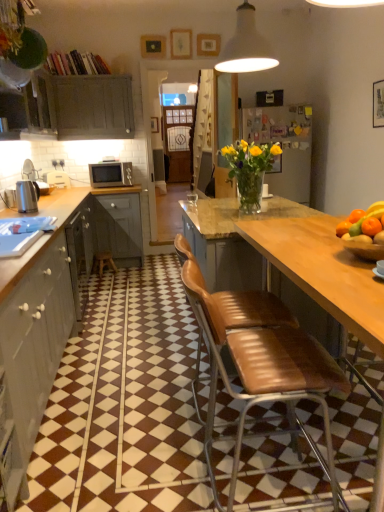
Question: Considering their positions, is brown leather bar stool at center located in front of or behind matte gray cabinet at left, the first cabinetry positioned from the top?

Choices:
 (A) behind
 (B) front

Answer: (A)

Question: Do you think brown leather bar stool at center is within matte gray cabinet at left, which ranks as the first cabinetry in back-to-front order, or outside of it?

Choices:
 (A) outside
 (B) inside

Answer: (A)

Question: Estimate the real-world distances between objects in this image. Which object is farther from the matte gray cabinets at left, which ranks as the 2th cabinetry in front-to-back order?

Choices:
 (A) wooden picture frame at upper center
 (B) brown leather chair at center, which appears as the second chair when viewed from the front
 (C) polished stainless steel kettle at left
 (D) matte gray cabinets at left, which is the 1th cabinetry from front to back
 (E) brown leather chair at center, positioned as the 1th chair in front-to-back order

Answer: (A)

Question: Which of these objects is positioned farthest from the brown leather chair at center, which appears as the second chair when viewed from the back?

Choices:
 (A) matte gray cabinets at left, which ranks as the 2th cabinetry in front-to-back order
 (B) wooden picture frame at upper center
 (C) matte gray cabinets at left, which is the 1th cabinetry from front to back
 (D) matte gray cabinet at left, placed as the 3th cabinetry when sorted from front to back
 (E) brown leather chair at center, acting as the 1th chair starting from the back

Answer: (B)